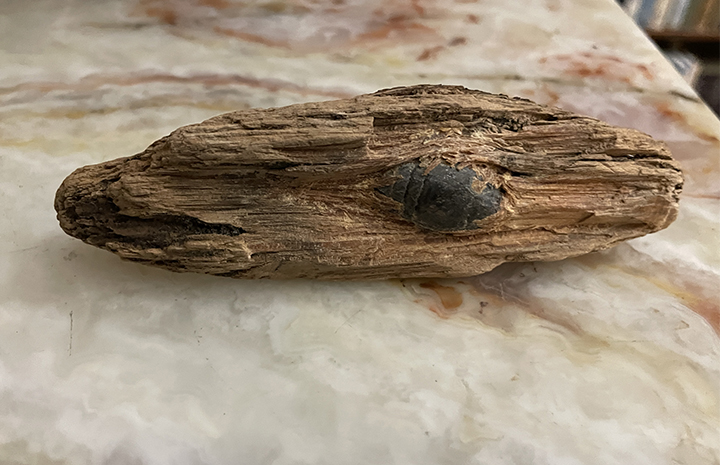
The image size is (720, 465). I want to click on marble, so click(389, 359).